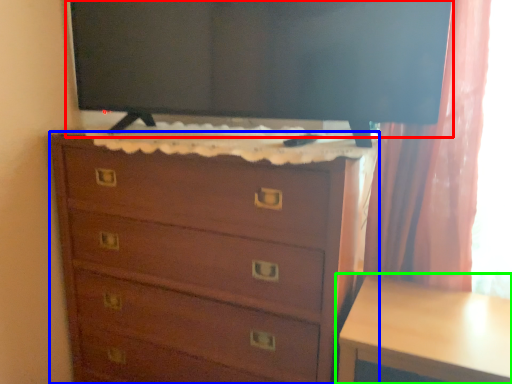
Question: Considering the real-world distances, which object is closest to tv show (highlighted by a red box)? chest of drawers (highlighted by a blue box) or table (highlighted by a green box).

Choices:
 (A) chest of drawers
 (B) table

Answer: (A)